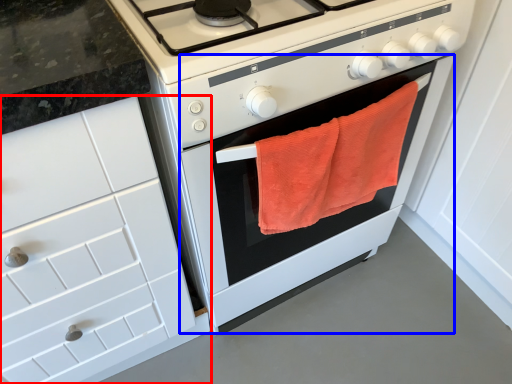
Question: Which object appears closest to the camera in this image, cabinetry (highlighted by a red box) or oven (highlighted by a blue box)?

Choices:
 (A) cabinetry
 (B) oven

Answer: (A)